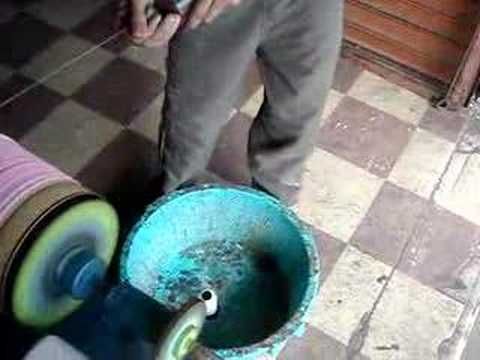
Find the location of a particular element. The image size is (480, 360). grey tile in floor is located at coordinates (395, 231).